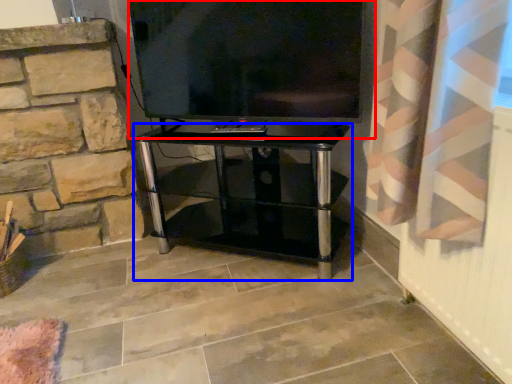
Question: Among these objects, which one is nearest to the camera, television (highlighted by a red box) or furniture (highlighted by a blue box)?

Choices:
 (A) television
 (B) furniture

Answer: (A)